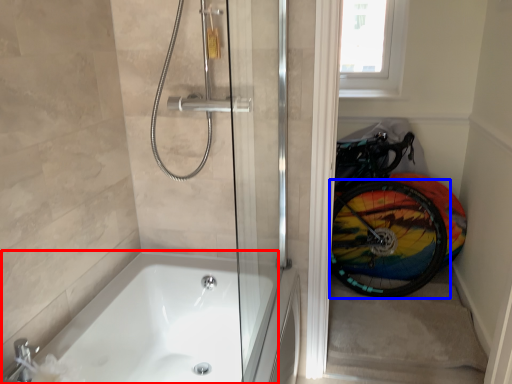
Question: Which point is closer to the camera, bathtub (highlighted by a red box) or bicycle wheel (highlighted by a blue box)?

Choices:
 (A) bathtub
 (B) bicycle wheel

Answer: (A)